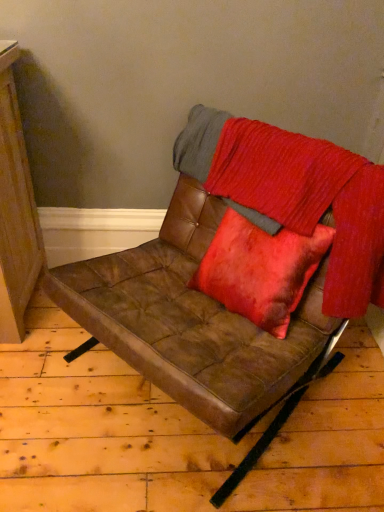
Question: Is velvet red blanket at center next to brown leather chair at center?

Choices:
 (A) yes
 (B) no

Answer: (B)

Question: Is velvet red blanket at center located outside brown leather chair at center?

Choices:
 (A) yes
 (B) no

Answer: (B)

Question: From a real-world perspective, is velvet red blanket at center below brown leather chair at center?

Choices:
 (A) no
 (B) yes

Answer: (A)

Question: Considering the relative sizes of velvet red blanket at center and brown leather chair at center in the image provided, is velvet red blanket at center smaller than brown leather chair at center?

Choices:
 (A) no
 (B) yes

Answer: (B)

Question: Is velvet red blanket at center oriented away from brown leather chair at center?

Choices:
 (A) yes
 (B) no

Answer: (A)

Question: From a real-world perspective, is velvet red blanket at center on top of brown leather chair at center?

Choices:
 (A) no
 (B) yes

Answer: (B)

Question: Considering the relative positions of brown leather chair at center and velvet red blanket at center in the image provided, is brown leather chair at center in front of velvet red blanket at center?

Choices:
 (A) yes
 (B) no

Answer: (A)

Question: Is velvet red blanket at center located within brown leather chair at center?

Choices:
 (A) no
 (B) yes

Answer: (B)

Question: Is brown leather chair at center taller than velvet red blanket at center?

Choices:
 (A) yes
 (B) no

Answer: (A)

Question: Is brown leather chair at center next to velvet red blanket at center?

Choices:
 (A) yes
 (B) no

Answer: (B)

Question: From a real-world perspective, does brown leather chair at center stand above velvet red blanket at center?

Choices:
 (A) no
 (B) yes

Answer: (A)

Question: Considering the relative positions of brown leather chair at center and velvet red blanket at center in the image provided, is brown leather chair at center to the right of velvet red blanket at center from the viewer's perspective?

Choices:
 (A) yes
 (B) no

Answer: (B)

Question: From the image's perspective, is velvet red blanket at center positioned above or below brown leather chair at center?

Choices:
 (A) below
 (B) above

Answer: (B)